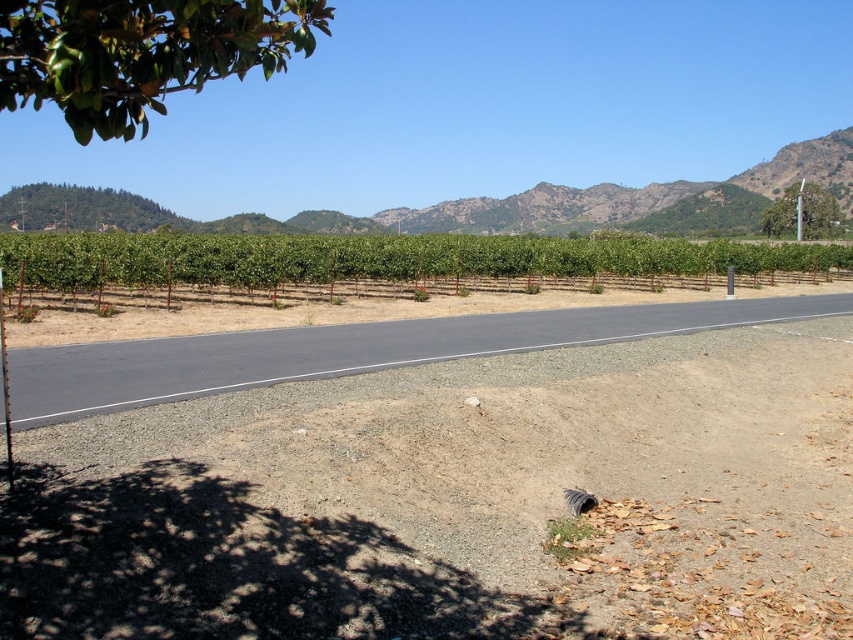
You are a hiker walking along the road in the image and want to reach the green leafy tree at upper right. Which direction should you walk to get there from the green leafy vines at center?

The green leafy vines at center are in front of the green leafy tree at upper right, so you should walk backward to reach the green leafy tree at upper right.

You are a gardener planning to prune the green leafy vines at center and the green leafy tree at upper right. Which one would you need to use a ladder for, considering their sizes?

The green leafy vines at center is bigger than the green leafy tree at upper right, so you would need a ladder for the green leafy vines at center.

You are a hiker standing on the road and want to take a photo of both the green leafy mountain at upper center and the green leafy tree at upper right. Which direction should you face to ensure both are visible in your camera frame?

You should face towards the upper right direction so that both the green leafy mountain at upper center and the green leafy tree at upper right are visible in your frame, as the mountain is to the left of the tree.